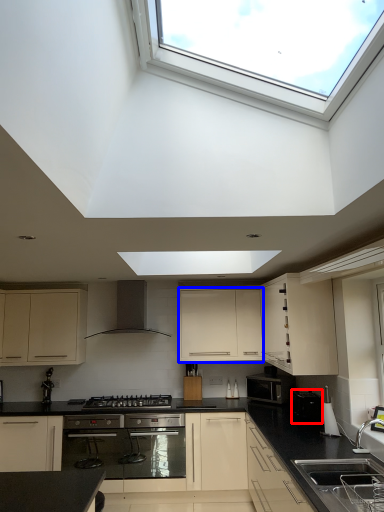
Question: Which object is further to the camera taking this photo, appliance (highlighted by a red box) or cabinetry (highlighted by a blue box)?

Choices:
 (A) appliance
 (B) cabinetry

Answer: (B)